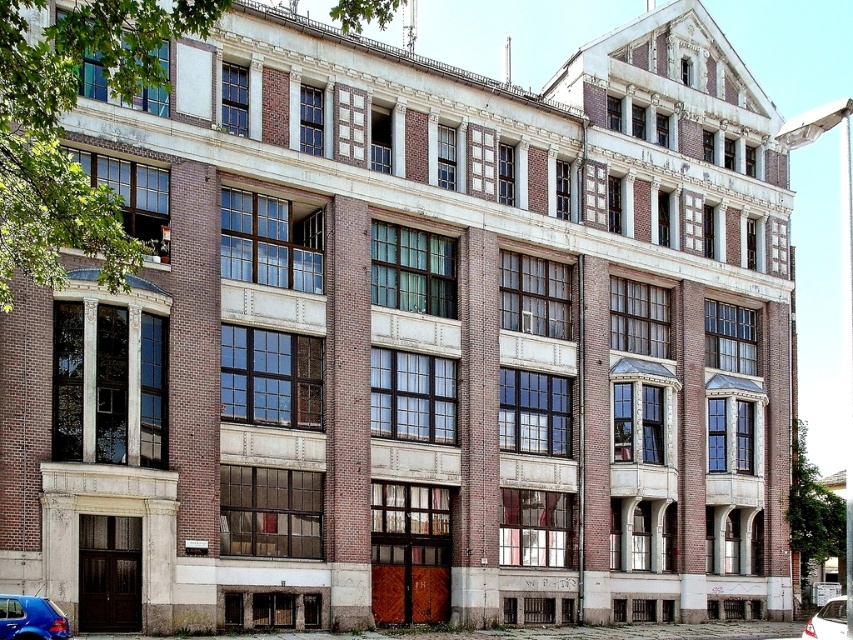
You are standing in front of the building and see both the shiny blue car at lower left and the white glossy car at lower right. Which car is positioned closer to the left side of the building?

The shiny blue car at lower left is positioned closer to the left side of the building compared to the white glossy car at lower right.

You are a delivery person trying to park a van that is 6 meters long between the shiny blue car at lower left and the white glossy car at lower right. Based on the scene, can you fit your van there?

The shiny blue car at lower left is smaller than the white glossy car at lower right, but the distance between them isn